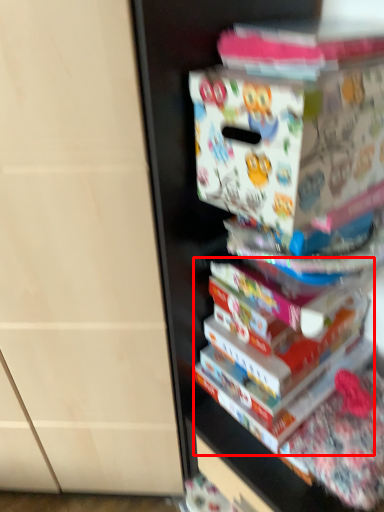
Question: From the image, what is the correct spatial relationship of book (annotated by the red box) in relation to paperback book?

Choices:
 (A) right
 (B) left

Answer: (A)